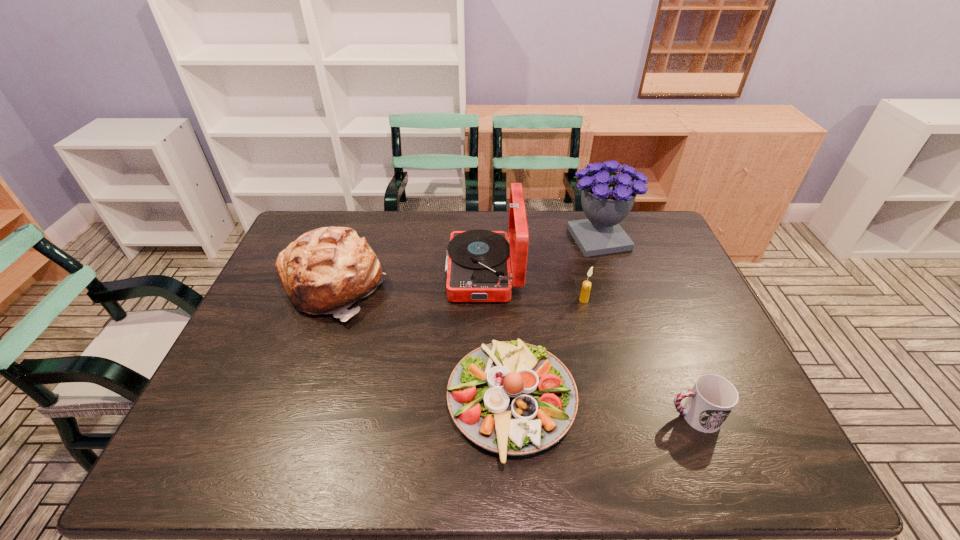
Image resolution: width=960 pixels, height=540 pixels. What are the coordinates of `free space located 0.220m on the front-facing side of the phonograph_record` in the screenshot? It's located at (376, 273).

Locate an element on the screen. The image size is (960, 540). free location located on the front of the third tallest object is located at coordinates (284, 420).

Locate an element on the screen. Image resolution: width=960 pixels, height=540 pixels. free space located 0.120m on the right of the candle is located at coordinates (629, 300).

I want to click on vacant space located on the handle side of the cup, so click(x=494, y=416).

Locate an element on the screen. free space located 0.280m on the handle side of the cup is located at coordinates (546, 416).

Where is `vacant space situated 0.230m on the handle side of the cup`? Image resolution: width=960 pixels, height=540 pixels. vacant space situated 0.230m on the handle side of the cup is located at coordinates (568, 416).

In order to click on free spot located 0.250m on the left of the salad plate in this screenshot , I will do `click(342, 403)`.

The image size is (960, 540). I want to click on bouquet that is positioned at the far edge, so click(607, 198).

Image resolution: width=960 pixels, height=540 pixels. What are the coordinates of `phonograph_record that is positioned at the far edge` in the screenshot? It's located at pos(478,269).

The height and width of the screenshot is (540, 960). I want to click on bread located at the far edge, so click(x=326, y=270).